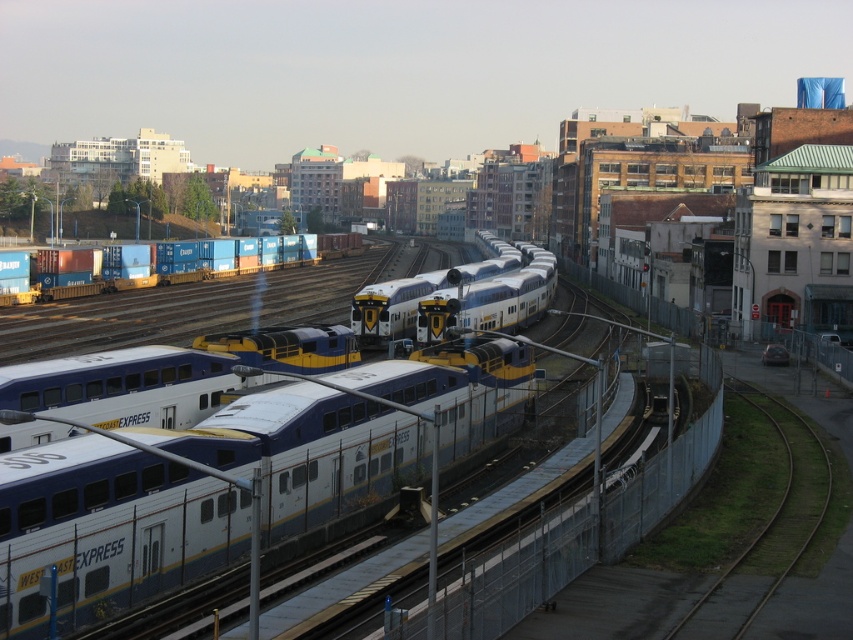
Question: Can you confirm if white glossy passenger train at center is positioned to the right of green grass train track at lower right?

Choices:
 (A) no
 (B) yes

Answer: (A)

Question: Which object is closer to the camera taking this photo?

Choices:
 (A) green grass train track at lower right
 (B) white glossy passenger train at center
 (C) blue matte freight container at left

Answer: (B)

Question: Among these objects, which one is nearest to the camera?

Choices:
 (A) green grass train track at lower right
 (B) white glossy passenger train at center

Answer: (B)

Question: Based on their relative distances, which object is nearer to the blue matte freight container at left?

Choices:
 (A) green grass train track at lower right
 (B) white glossy passenger train at center

Answer: (B)

Question: Is white glossy passenger train at center to the left of green grass train track at lower right from the viewer's perspective?

Choices:
 (A) no
 (B) yes

Answer: (B)

Question: Does blue matte freight container at left appear on the left side of green grass train track at lower right?

Choices:
 (A) yes
 (B) no

Answer: (A)